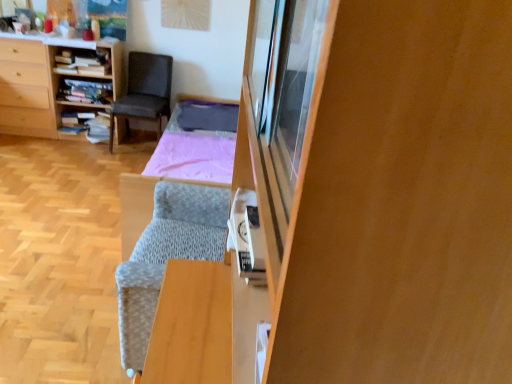
This screenshot has height=384, width=512. Identify the location of vacant location below dark gray fabric chair at upper left (from a real-world perspective). click(x=135, y=141).